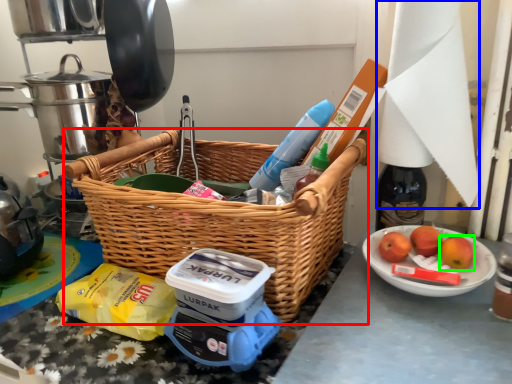
Question: Considering the real-world distances, which object is closest to picnic basket (highlighted by a red box)? paper towel (highlighted by a blue box) or apple (highlighted by a green box).

Choices:
 (A) paper towel
 (B) apple

Answer: (A)